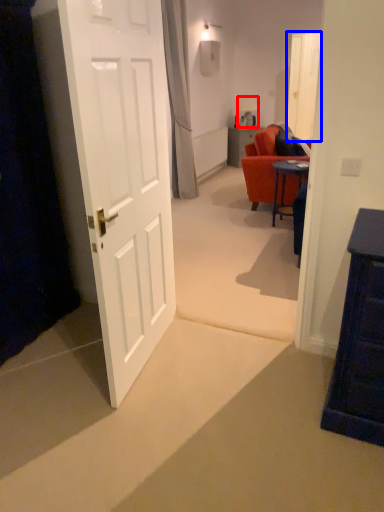
Question: Which object appears closest to the camera in this image, lamp (highlighted by a red box) or glass door (highlighted by a blue box)?

Choices:
 (A) lamp
 (B) glass door

Answer: (B)